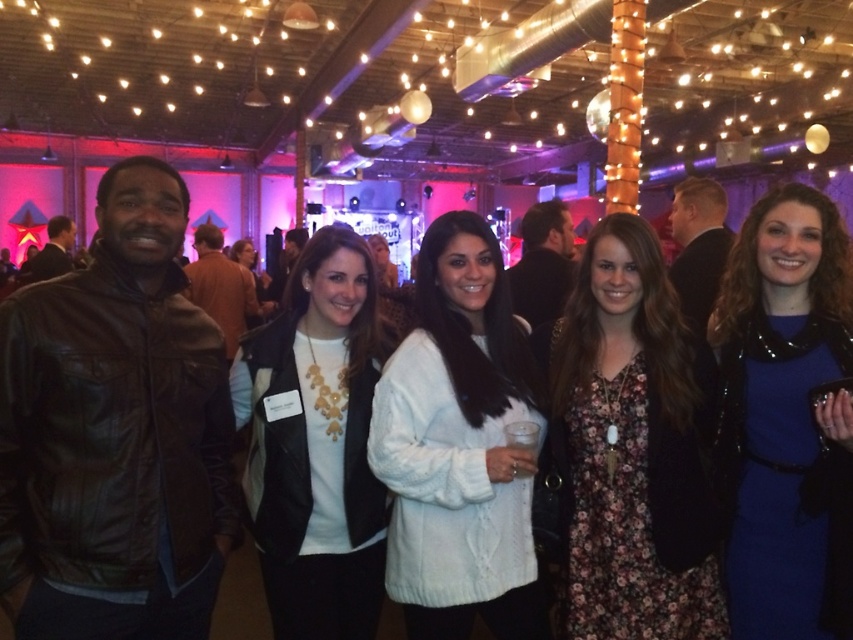
Question: Is blue satin dress at center wider than white matte sweater at center?

Choices:
 (A) yes
 (B) no

Answer: (B)

Question: Which point is farther to the camera?

Choices:
 (A) coord(616,396)
 (B) coord(489,378)
 (C) coord(802,285)

Answer: (B)

Question: Is blue satin dress at center below white matte sweater at center?

Choices:
 (A) no
 (B) yes

Answer: (A)

Question: Can you confirm if blue satin dress at center is positioned below white matte sweater at center?

Choices:
 (A) yes
 (B) no

Answer: (B)

Question: Which point appears closest to the camera in this image?

Choices:
 (A) (270, 282)
 (B) (236, 387)

Answer: (B)

Question: Which point is closer to the camera?

Choices:
 (A) (751, 618)
 (B) (289, 572)
 (C) (601, 602)
 (D) (495, 614)

Answer: (C)